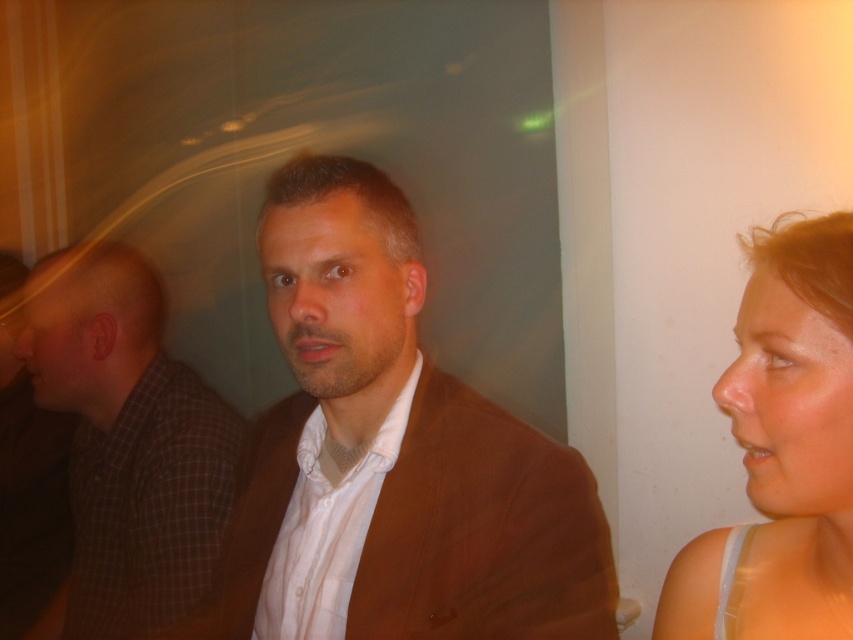
You are taking a photo of two points in the image. The first point is labeled as point [320,611] and the second is point [64,636]. Which point appears closer to the camera?

Point [320,611] is closer to the camera than point [64,636].

Looking at this image, you are a fashion designer analyzing the image. You need to determine which garment has a longer length between the brown fabric jacket at center and the brown checkered shirt at left. Which one is longer?

The brown checkered shirt at left is longer than the brown fabric jacket at center.

You are a photographer adjusting the focus on a camera. The subject is the brown fabric jacket at center and the smooth skin face at right. If you want to capture both in focus, what should you consider about their distance?

The brown fabric jacket at center is 9.77 inches away from the smooth skin face at right. To capture both in focus, ensure the camera has a depth of field that can cover this distance between them.